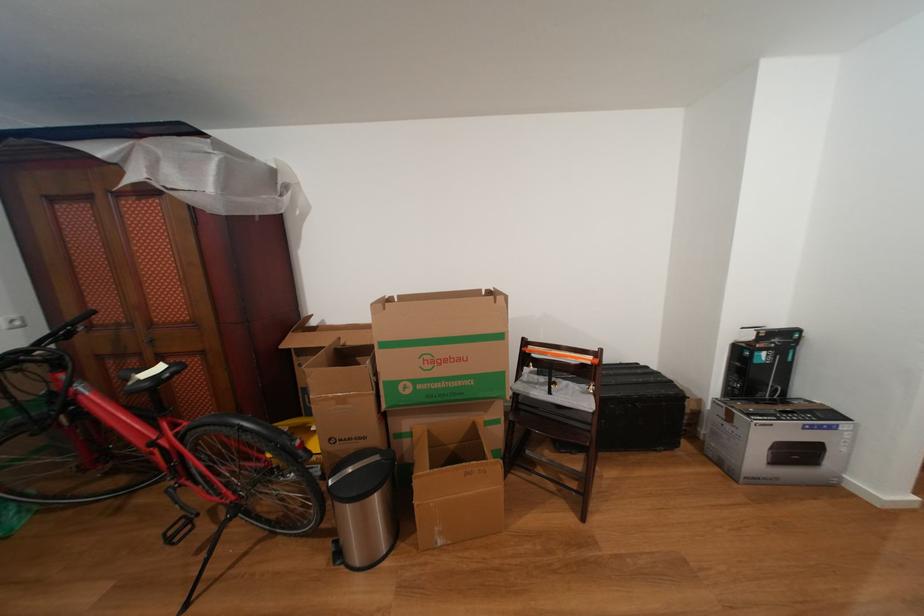
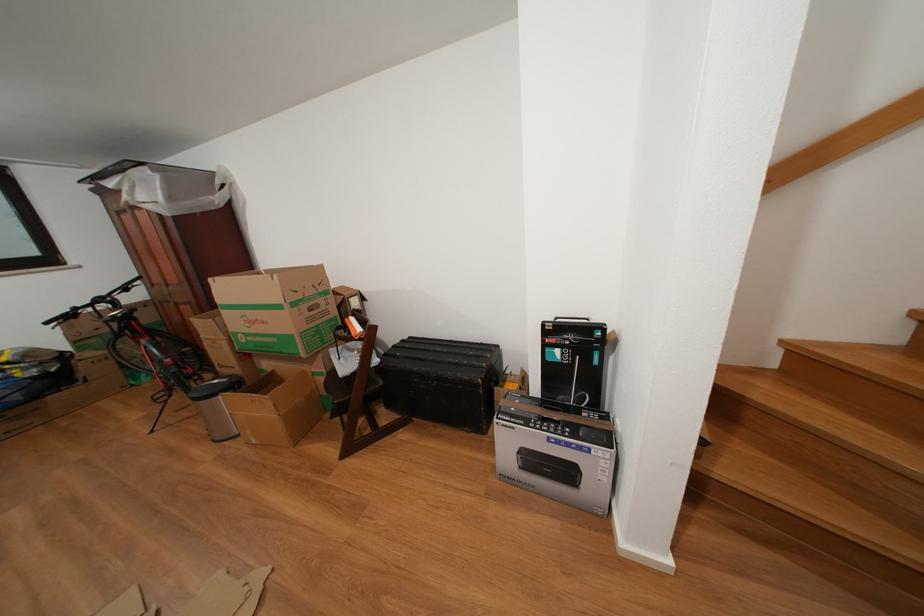
Locate, in the second image, the point that corresponds to the point at 468,365 in the first image.

(272, 328)